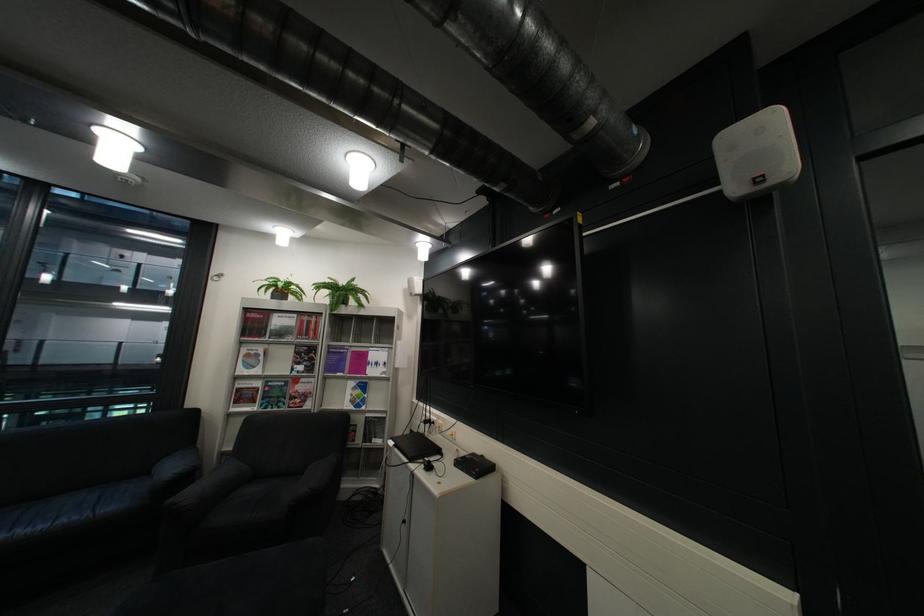
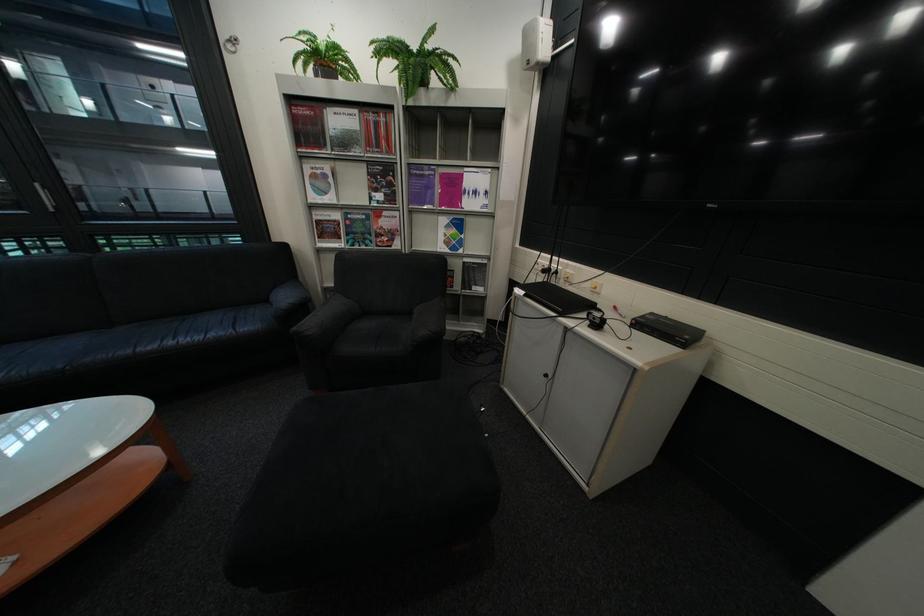
Where in the second image is the point corresponding to the point at 264,336 from the first image?

(322, 147)